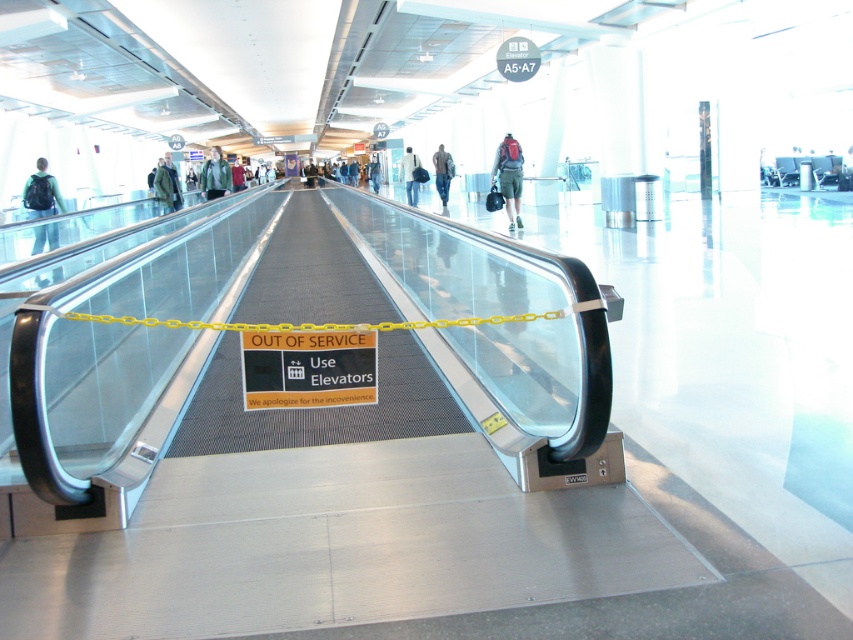
You are a passenger at the airport and see a matte black backpack at left and a red backpack at center. Which backpack is positioned further to the left?

The matte black backpack at left is positioned further to the left than the red backpack at center.

You are a traveler carrying a matte black backpack at left and wearing denim pants at center. You need to walk along the moving walkway. Considering the width of the walkway, will your backpack interfere with others walking next to you?

The matte black backpack at left is wider than the denim pants at center. Since the walkway is flanked by glass railings, the backpack might protrude into the space of others, so it is advisable to adjust your position to avoid obstruction.

You are a passenger at the airport and see the matte black backpack at left. Where is it located relative to the OUT OF SERVICE sign?

The matte black backpack at left is located at point (41, 193) relative to the OUT OF SERVICE sign.